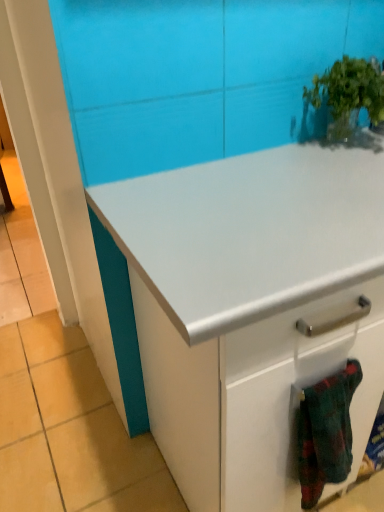
Question: Is flannel fabric blanket at lower right touching green leafy plant at upper right?

Choices:
 (A) no
 (B) yes

Answer: (A)

Question: Is flannel fabric blanket at lower right not near green leafy plant at upper right?

Choices:
 (A) yes
 (B) no

Answer: (B)

Question: From a real-world perspective, does flannel fabric blanket at lower right stand above green leafy plant at upper right?

Choices:
 (A) yes
 (B) no

Answer: (B)

Question: Can you confirm if flannel fabric blanket at lower right is wider than green leafy plant at upper right?

Choices:
 (A) no
 (B) yes

Answer: (A)

Question: From the image's perspective, is flannel fabric blanket at lower right located above green leafy plant at upper right?

Choices:
 (A) no
 (B) yes

Answer: (A)

Question: In terms of width, does green leafy plant at upper right look wider or thinner when compared to white glossy cabinet at center?

Choices:
 (A) wide
 (B) thin

Answer: (B)

Question: Is green leafy plant at upper right bigger or smaller than white glossy cabinet at center?

Choices:
 (A) small
 (B) big

Answer: (A)

Question: Is green leafy plant at upper right in front of or behind white glossy cabinet at center in the image?

Choices:
 (A) front
 (B) behind

Answer: (B)

Question: Is green leafy plant at upper right inside the boundaries of white glossy cabinet at center, or outside?

Choices:
 (A) inside
 (B) outside

Answer: (B)

Question: Based on their sizes in the image, would you say flannel fabric blanket at lower right is bigger or smaller than green leafy plant at upper right?

Choices:
 (A) small
 (B) big

Answer: (A)

Question: Is flannel fabric blanket at lower right to the left or to the right of green leafy plant at upper right in the image?

Choices:
 (A) left
 (B) right

Answer: (A)

Question: In the image, is flannel fabric blanket at lower right positioned in front of or behind green leafy plant at upper right?

Choices:
 (A) front
 (B) behind

Answer: (A)

Question: Considering the positions of point tap(329, 465) and point tap(316, 86), is point tap(329, 465) closer or farther from the camera than point tap(316, 86)?

Choices:
 (A) closer
 (B) farther

Answer: (A)

Question: From a real-world perspective, relative to flannel fabric blanket at lower right, is white glossy cabinet at center vertically above or below?

Choices:
 (A) below
 (B) above

Answer: (A)

Question: Considering the positions of white glossy cabinet at center and flannel fabric blanket at lower right in the image, is white glossy cabinet at center bigger or smaller than flannel fabric blanket at lower right?

Choices:
 (A) small
 (B) big

Answer: (B)